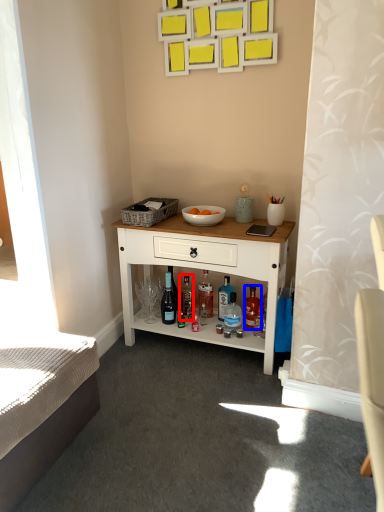
Question: Among these objects, which one is farthest to the camera, bottle (highlighted by a red box) or bottle (highlighted by a blue box)?

Choices:
 (A) bottle
 (B) bottle

Answer: (A)